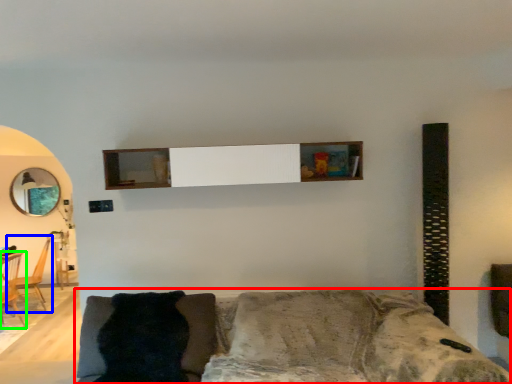
Question: Which object is positioned farthest from studio couch (highlighted by a red box)? Select from armchair (highlighted by a blue box) and armchair (highlighted by a green box).

Choices:
 (A) armchair
 (B) armchair

Answer: (A)